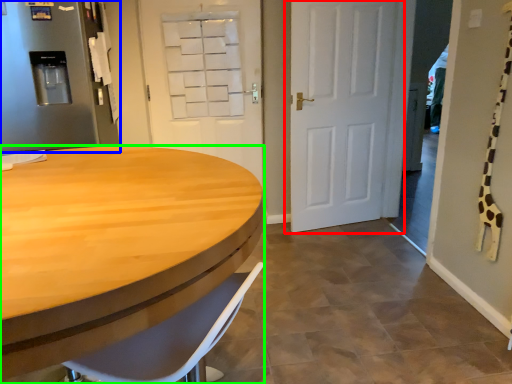
Question: Which is nearer to the door (highlighted by a red box)? refrigerator (highlighted by a blue box) or desk (highlighted by a green box).

Choices:
 (A) refrigerator
 (B) desk

Answer: (A)